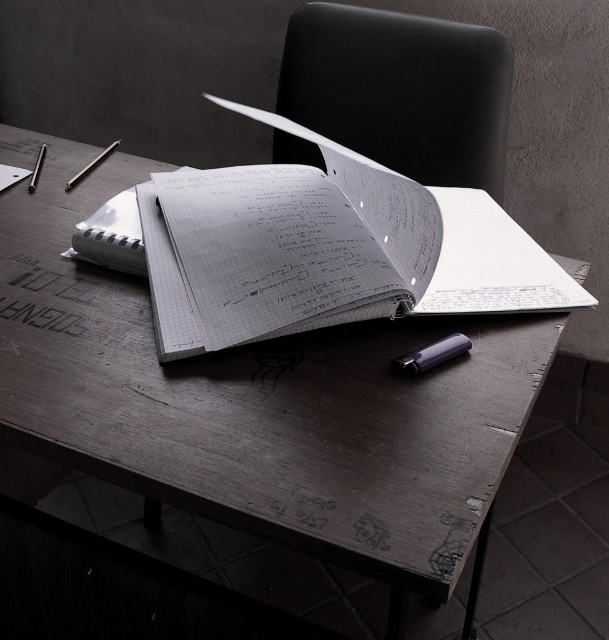
What object is located at the coordinates point (325, 248) in the workspace setup?

The point (325, 248) indicates the white paper notebook at center.

You are organizing the desk and need to place a new item between the white paper notebook at center and the matte purple pencil at center. Is there enough space between them for the new item?

The white paper notebook at center is positioned over the matte purple pencil at center, meaning there is no space between them. Therefore, there is no room to place a new item between them.

You are sitting in the black leather chair at upper center and want to pick up the matte purple pencil at center. Can you reach it without moving your chair?

The matte purple pencil at center is behind the black leather chair at upper center, so you cannot reach it without moving your chair.